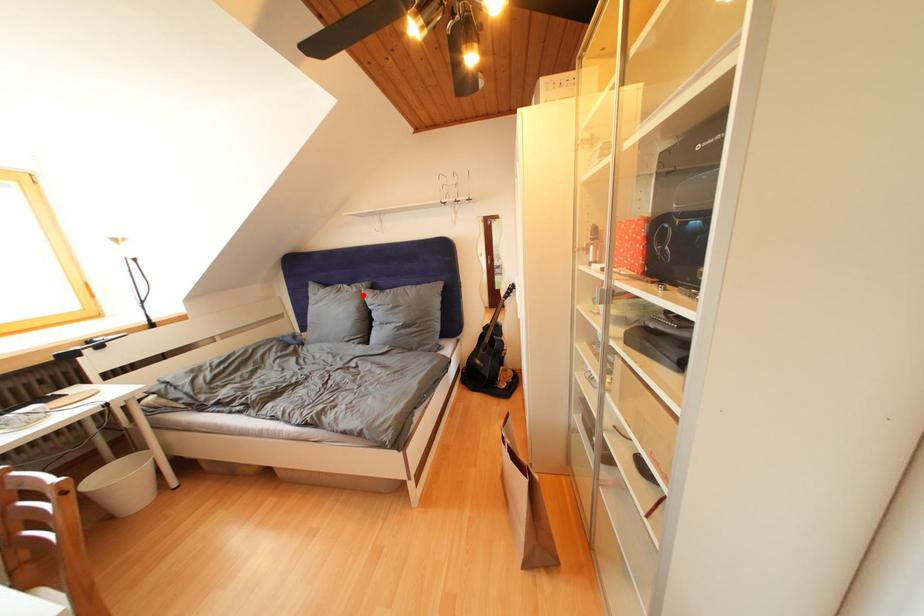
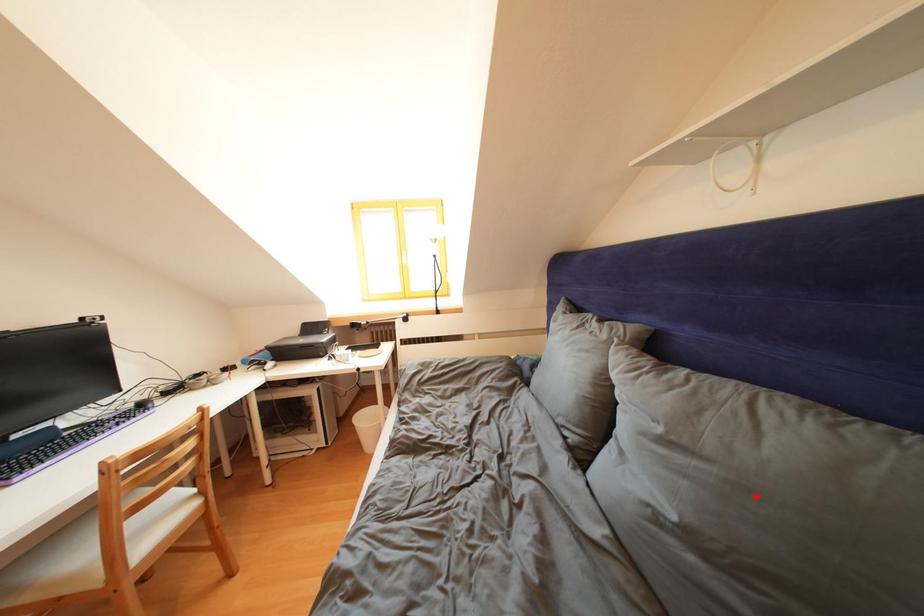
I am providing you with two images of the same scene from different viewpoints. A red point is marked on the first image and another point is marked on the second image. Are the points marked in image1 and image2 representing the same 3D position?

No